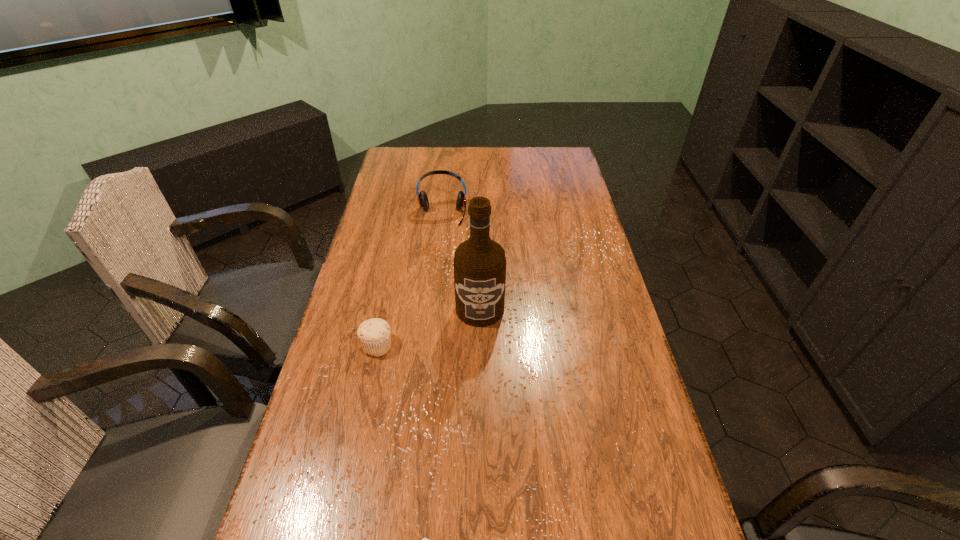
In the image, there is a desktop. Where is `free space at the far edge`? This screenshot has height=540, width=960. free space at the far edge is located at coordinates (513, 169).

Identify the location of vacant area at the left edge. This screenshot has height=540, width=960. (395, 179).

In the image, there is a desktop. In order to click on vacant space at the right edge in this screenshot , I will do `click(587, 205)`.

The width and height of the screenshot is (960, 540). I want to click on vacant space at the far right corner of the desktop, so click(565, 173).

Identify the location of free space between the alcohol and the third tallest object. (428, 327).

Identify the location of vacant space that's between the second shortest object and the second farthest object. (428, 327).

Identify the location of free area in between the third tallest object and the farthest object. (410, 280).

Locate which object ranks in proximity to the shortest object. Please provide its 2D coordinates. Your answer should be formatted as a tuple, i.e. [(x, y)], where the tuple contains the x and y coordinates of a point satisfying the conditions above.

[(374, 334)]

Identify the location of object that can be found as the third closest to the third shortest object. This screenshot has width=960, height=540. (424, 539).